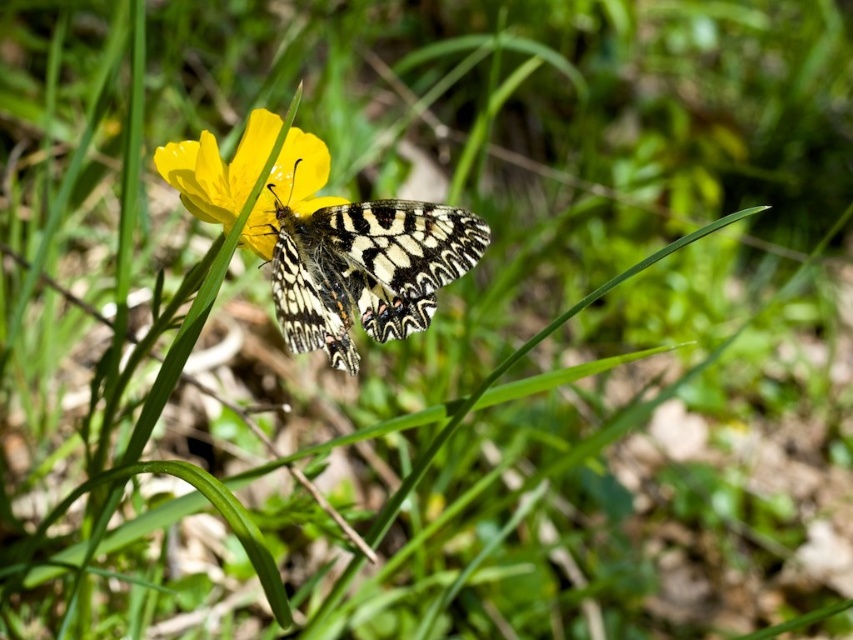
You are a botanist studying the positioning of plants and insects in a natural habitat. You observe the patterned wings butterfly at center and the yellow matte flower at center in the scene. Which object is positioned higher in the image?

The patterned wings butterfly at center is much taller than the yellow matte flower at center, so the patterned wings butterfly at center is positioned higher in the image.

Looking at this image, you are a photographer trying to capture the butterfly on the flower. You notice a point at coordinates (366, 269) in your viewfinder. According to the scene, what is this point likely part of?

The point at coordinates (366, 269) is on the patterned wings of the butterfly at the center, so it is part of the butterfly.